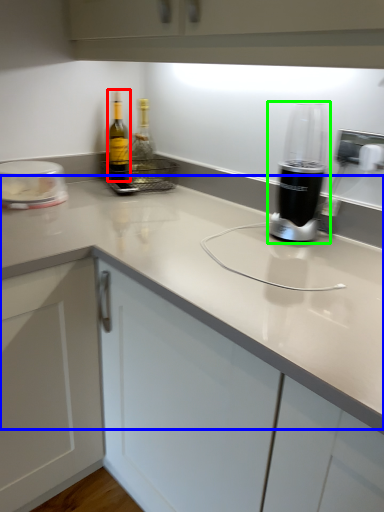
Question: Which is nearer to the bottle (highlighted by a red box)? counter top (highlighted by a blue box) or home appliance (highlighted by a green box).

Choices:
 (A) counter top
 (B) home appliance

Answer: (A)